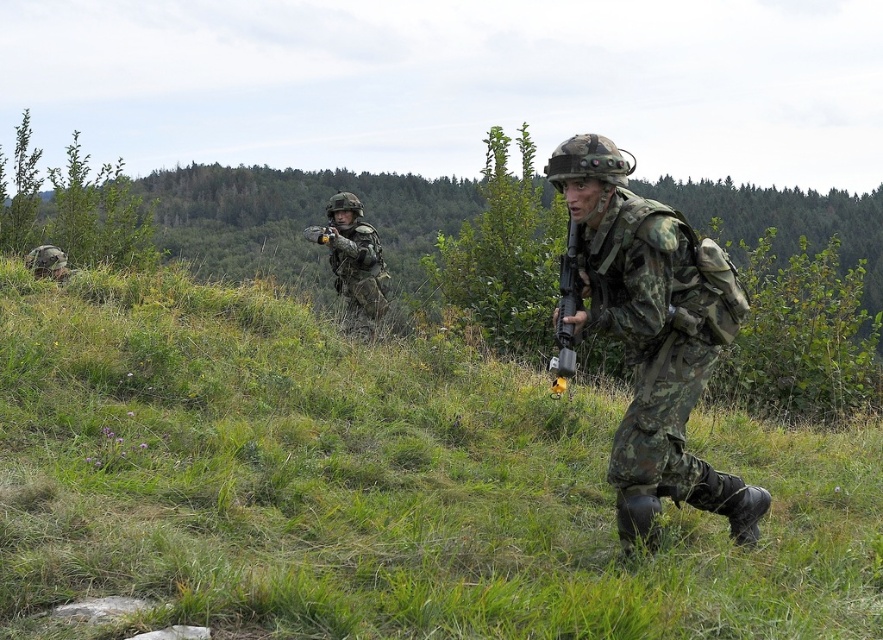
You are a soldier in the training exercise and need to move from your current position to the dense forest in the background. Which object, the green grassy at center or the camouflage fabric helmet at center, would you have to navigate around first?

The green grassy at center is closer to the viewer than the camouflage fabric helmet at center, so you would need to navigate around the green grassy at center first before reaching the camouflage fabric helmet at center.

In the scene of soldiers training outdoors, you notice two objects at the center of the image. One is green grassy at center and the other is camouflage fabric helmet at center. Which of these two objects is positioned more to the right side?

The green grassy at center is positioned to the right of the camouflage fabric helmet at center.